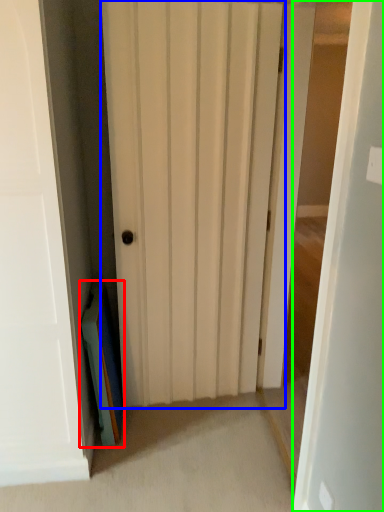
Question: Estimate the real-world distances between objects in this image. Which object is farther from book (highlighted by a red box), door (highlighted by a blue box) or door (highlighted by a green box)?

Choices:
 (A) door
 (B) door

Answer: (B)